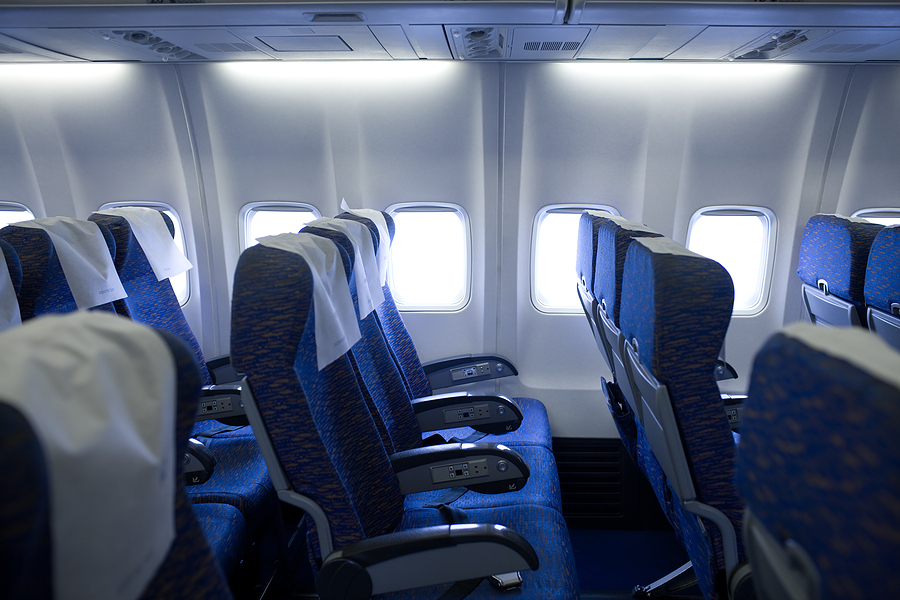
Locate an element on the screen. The image size is (900, 600). seat trays is located at coordinates (643, 402), (608, 368), (596, 331), (832, 321), (878, 330), (781, 568).